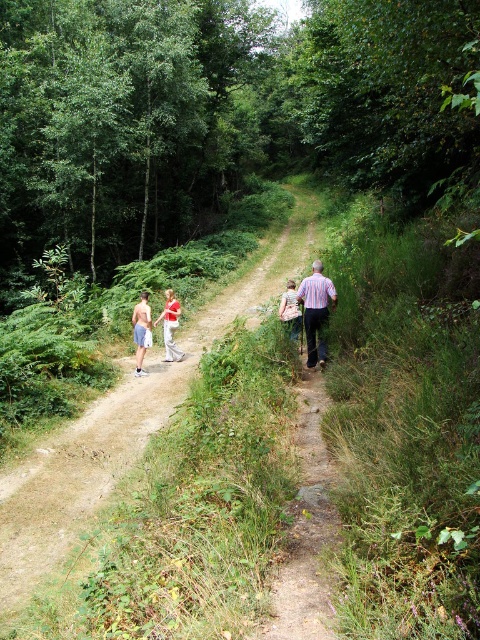
You are standing at the starting point of the forest trail and see two points marked on the path. The first point is at coordinate point(x=309, y=312) and the second is at point(x=148, y=314). Which point should you reach first while walking along the trail?

Point(x=309, y=312) is in front of point(x=148, y=314), so you should reach point(x=309, y=312) first while walking along the trail.

You are standing at point A, which is at coordinates point (x=176, y=344). You want to walk to point B, which is at coordinates point (x=145, y=317). Which direction should you move relative to your current position?

You should move forward because point (x=145, y=317) is in front of point (x=176, y=344).